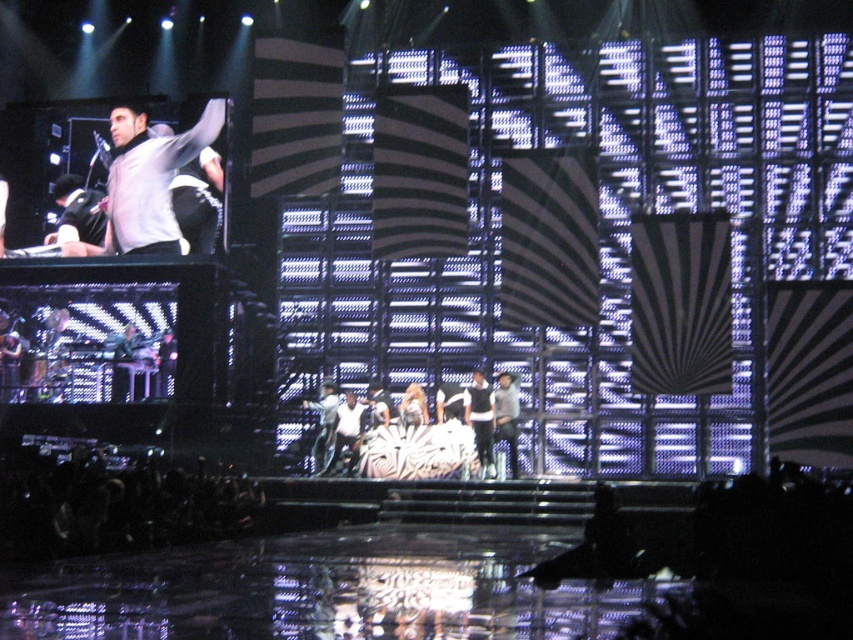
You are a photographer at the back of the venue trying to capture a clear photo of the matte gray hoodie at upper left and the denim jeans at center. Which object will appear closer to you in the photo?

The matte gray hoodie at upper left will appear closer to you in the photo since it is positioned further to the viewer than the denim jeans at center, making it occupy more space in the frame.

You are a stagehand trying to adjust the lighting for the white fabric at center and the white leather pants at center. Since both are white, you need to distinguish their positions. Which object is on the right side when looking at the stage from the audience perspective?

The white fabric at center is positioned on the right side of the white leather pants at center, so the white fabric at center is on the right.

You are a stagehand who needs to place a 6.5 feet long ladder between the white fabric at center and the denim jeans at center. Can the ladder fit between them without overlapping either object?

The distance between the white fabric at center and the denim jeans at center is 6.69 feet, which is slightly longer than the ladder. The ladder can fit between them without overlapping since 6.69 feet is greater than 6.5 feet.